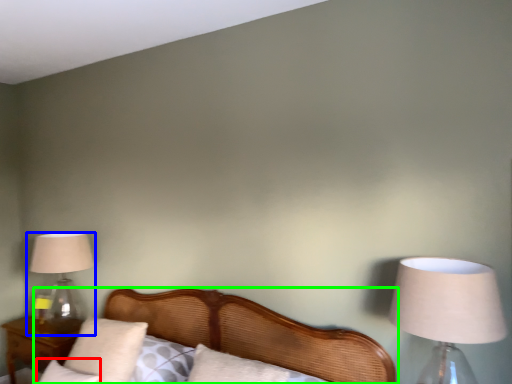
Question: Estimate the real-world distances between objects in this image. Which object is closer to pillow (highlighted by a red box), lamp (highlighted by a blue box) or bed (highlighted by a green box)?

Choices:
 (A) lamp
 (B) bed

Answer: (B)